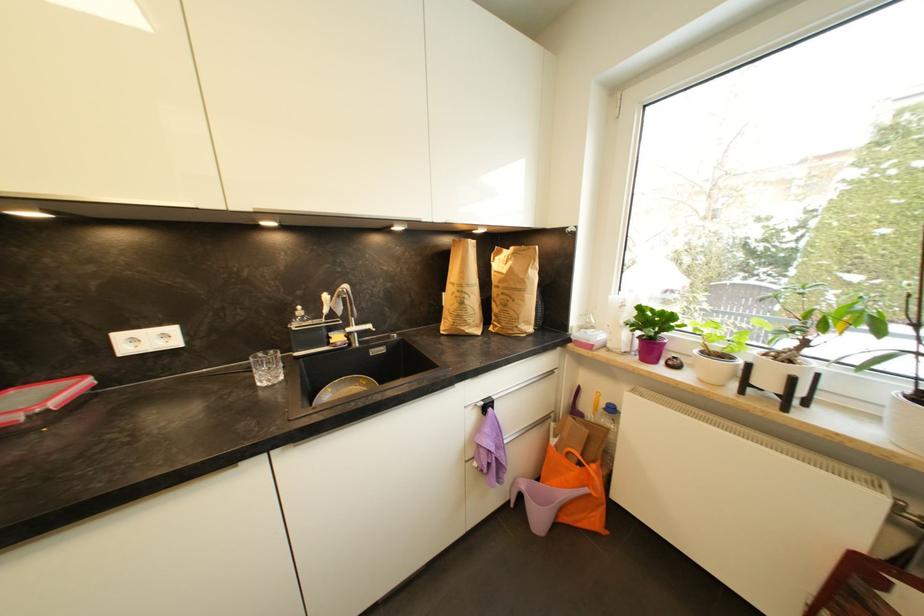
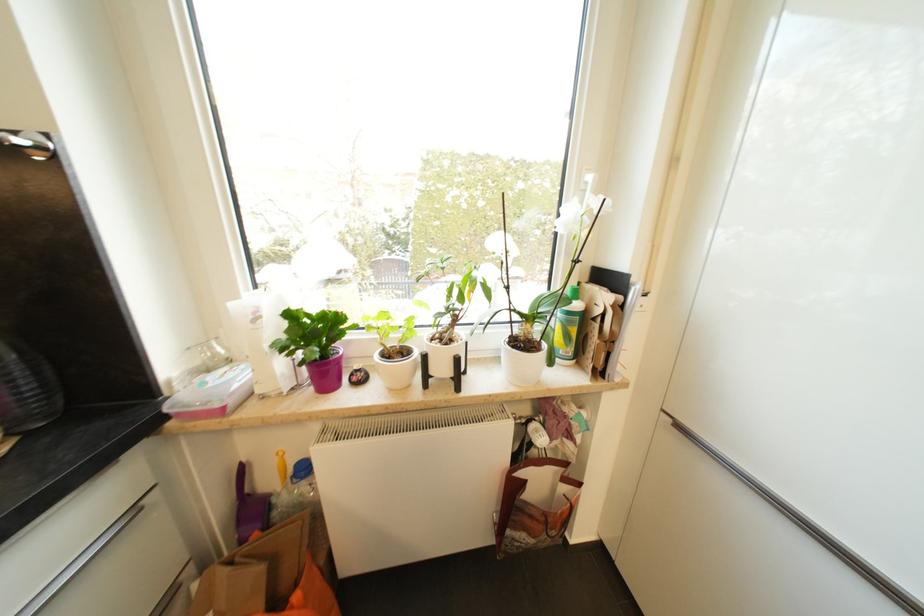
Locate, in the second image, the point that corresponds to the point at 645,310 in the first image.

(295, 317)